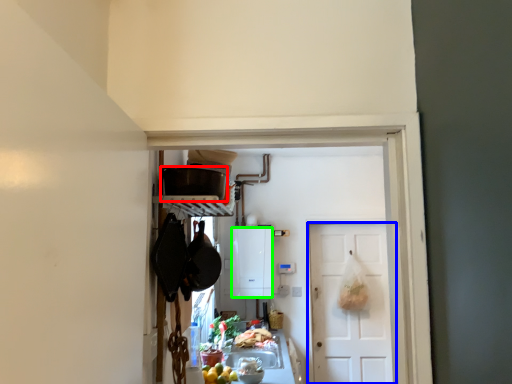
Question: Which object is the farthest from kitchen appliance (highlighted by a red box)? Choose among these: door (highlighted by a blue box) or cabinetry (highlighted by a green box).

Choices:
 (A) door
 (B) cabinetry

Answer: (A)